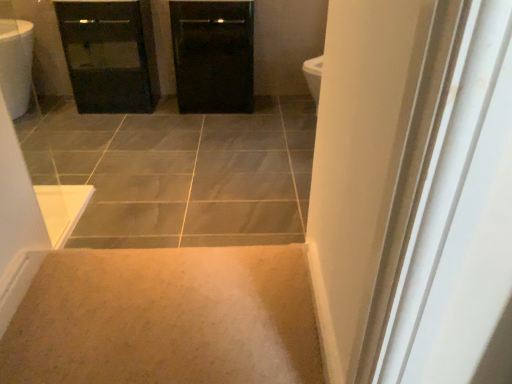
Question: From the image's perspective, is black glossy cabinet at center on black glossy cabinet at upper left?

Choices:
 (A) no
 (B) yes

Answer: (B)

Question: Considering the relative sizes of black glossy cabinet at center and black glossy cabinet at upper left in the image provided, is black glossy cabinet at center taller than black glossy cabinet at upper left?

Choices:
 (A) no
 (B) yes

Answer: (A)

Question: Is black glossy cabinet at center thinner than black glossy cabinet at upper left?

Choices:
 (A) no
 (B) yes

Answer: (B)

Question: Does black glossy cabinet at center appear on the right side of black glossy cabinet at upper left?

Choices:
 (A) yes
 (B) no

Answer: (A)

Question: From a real-world perspective, is black glossy cabinet at center positioned under black glossy cabinet at upper left based on gravity?

Choices:
 (A) no
 (B) yes

Answer: (A)

Question: Is beige carpet at lower center bigger or smaller than black glossy cabinet at center?

Choices:
 (A) big
 (B) small

Answer: (B)

Question: Is beige carpet at lower center to the left or to the right of black glossy cabinet at center in the image?

Choices:
 (A) right
 (B) left

Answer: (A)

Question: Is point (312, 317) closer or farther from the camera than point (251, 8)?

Choices:
 (A) closer
 (B) farther

Answer: (A)

Question: Considering the positions of beige carpet at lower center and black glossy cabinet at center in the image, is beige carpet at lower center taller or shorter than black glossy cabinet at center?

Choices:
 (A) tall
 (B) short

Answer: (B)

Question: Considering the positions of point pos(116,97) and point pos(183,84), is point pos(116,97) closer or farther from the camera than point pos(183,84)?

Choices:
 (A) closer
 (B) farther

Answer: (B)

Question: Considering their positions, is black glossy cabinet at upper left located in front of or behind black glossy cabinet at center?

Choices:
 (A) front
 (B) behind

Answer: (A)

Question: From the image's perspective, is black glossy cabinet at upper left positioned above or below black glossy cabinet at center?

Choices:
 (A) above
 (B) below

Answer: (B)

Question: Is black glossy cabinet at upper left situated inside black glossy cabinet at center or outside?

Choices:
 (A) inside
 (B) outside

Answer: (B)

Question: Considering the positions of black glossy cabinet at center and beige carpet at lower center in the image, is black glossy cabinet at center taller or shorter than beige carpet at lower center?

Choices:
 (A) short
 (B) tall

Answer: (B)

Question: Does point (189, 84) appear closer or farther from the camera than point (109, 367)?

Choices:
 (A) closer
 (B) farther

Answer: (B)